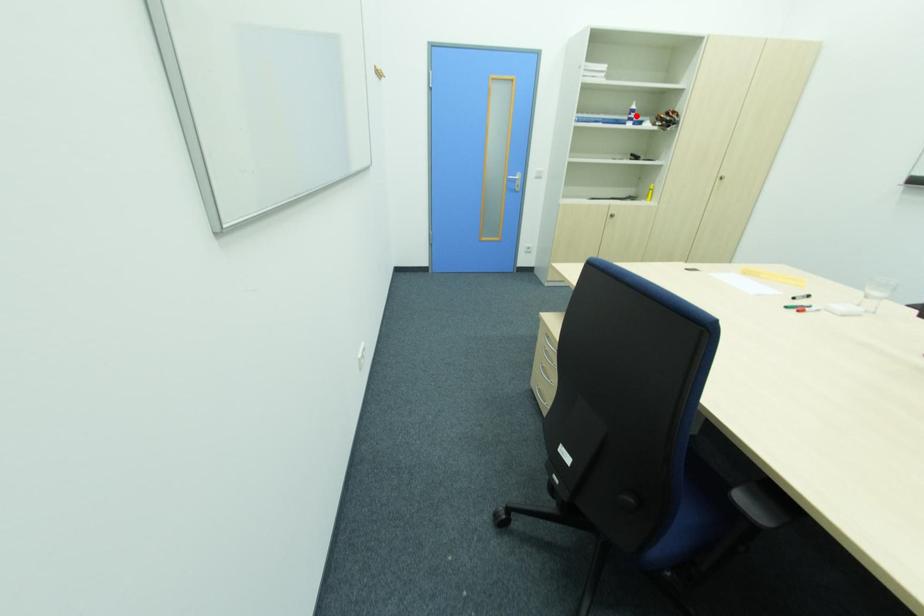
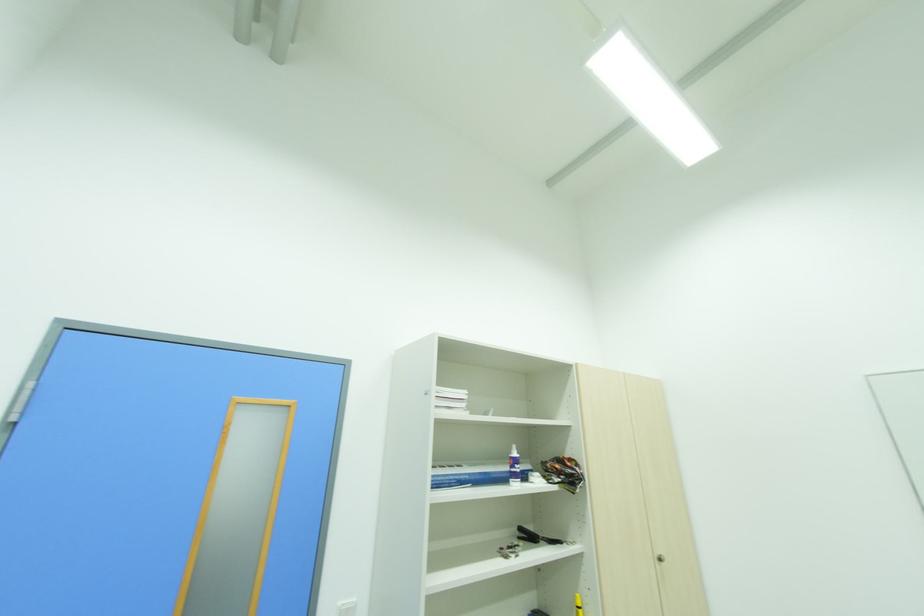
Question: I am providing you with two images of the same scene from different viewpoints. A red point is marked on the first image. At the location where the point appears in image 1, is it still visible in image 2?

Choices:
 (A) Yes
 (B) No

Answer: (A)